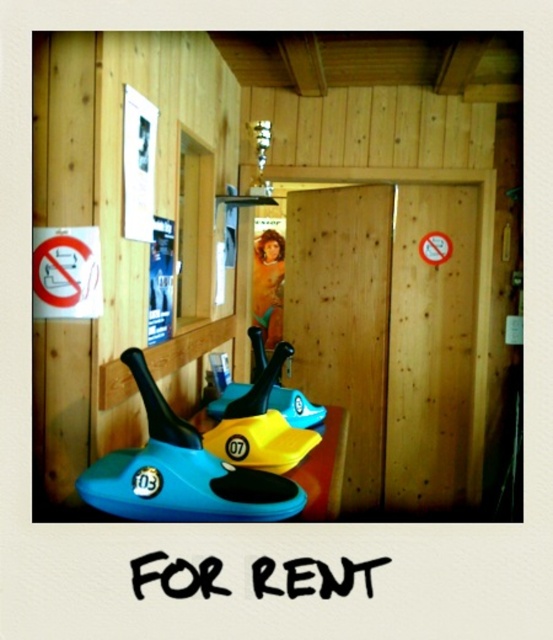
You are a visitor at this cabin and want to place your blue plastic snowboard at lower left on top of the blue rubber toy at center. Is this possible based on their current positions?

The blue plastic snowboard at lower left is already positioned above the blue rubber toy at center, so placing it there is already done.

You are organizing items in a storage room and need to place the blue plastic snowboard at lower left and the blue rubber toy at center. According to the scene, which item is located to the right of the other?

The blue plastic snowboard at lower left is positioned on the right side of blue rubber toy at center, so the snowboard is to the right of the toy.